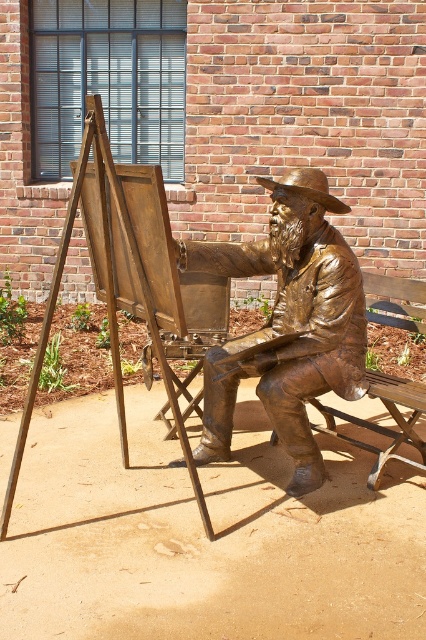
Consider the image. Does wooden easel at left appear on the right side of bronze textured cowboy hat at center?

In fact, wooden easel at left is to the left of bronze textured cowboy hat at center.

Between point (135, 300) and point (267, 186), which one is positioned in front?

Positioned in front is point (135, 300).

Does point (181, 440) come closer to viewer compared to point (314, 173)?

Yes, it is in front of point (314, 173).

Where is `wooden easel at left`? wooden easel at left is located at coordinates (118, 276).

Which of these two, bronze statue at center or wooden easel at left, stands taller?

wooden easel at left

Is point (331, 296) positioned in front of point (161, 355)?

No, it is not.

I want to click on bronze statue at center, so click(288, 323).

Which of these two, bronze statue at center or bronze textured cowboy hat at center, stands taller?

bronze statue at center

Is point (319, 326) more distant than point (317, 170)?

No, (319, 326) is in front of (317, 170).

The width and height of the screenshot is (426, 640). What are the coordinates of `bronze statue at center` in the screenshot? It's located at (288, 323).

Identify the location of bronze statue at center. This screenshot has width=426, height=640. (288, 323).